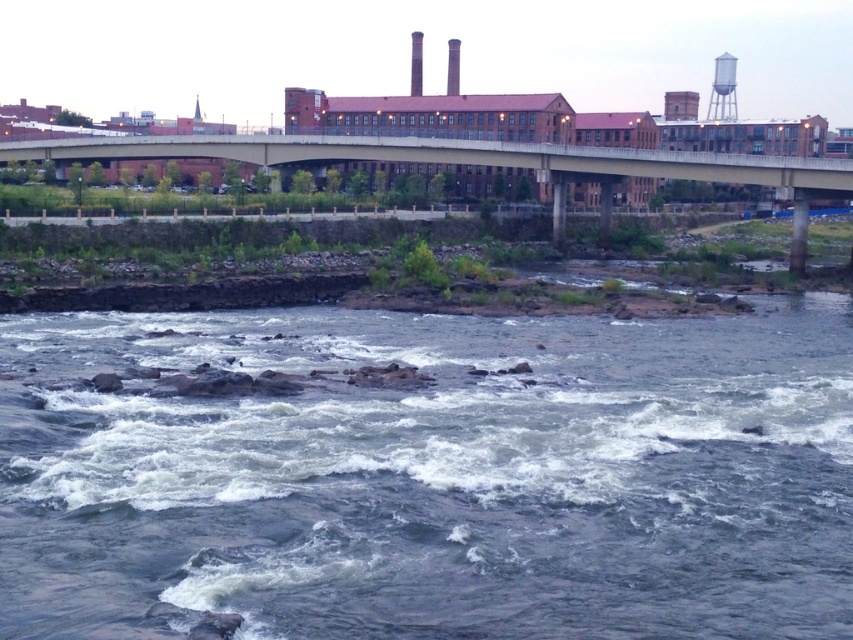
Question: Which of the following is the farthest from the observer?

Choices:
 (A) (450, 148)
 (B) (717, 70)

Answer: (B)

Question: Can you confirm if rough textured water at lower center is wider than concrete bridge at upper center?

Choices:
 (A) yes
 (B) no

Answer: (B)

Question: Does rough textured water at lower center have a lesser width compared to white metallic water tower at upper right?

Choices:
 (A) yes
 (B) no

Answer: (B)

Question: Can you confirm if rough textured water at lower center is positioned below white metallic water tower at upper right?

Choices:
 (A) no
 (B) yes

Answer: (B)

Question: Which of the following is the closest to the observer?

Choices:
 (A) (718, 67)
 (B) (238, 333)
 (C) (569, 179)

Answer: (B)

Question: Among these points, which one is farthest from the camera?

Choices:
 (A) (721, 72)
 (B) (798, 212)
 (C) (248, 413)

Answer: (A)